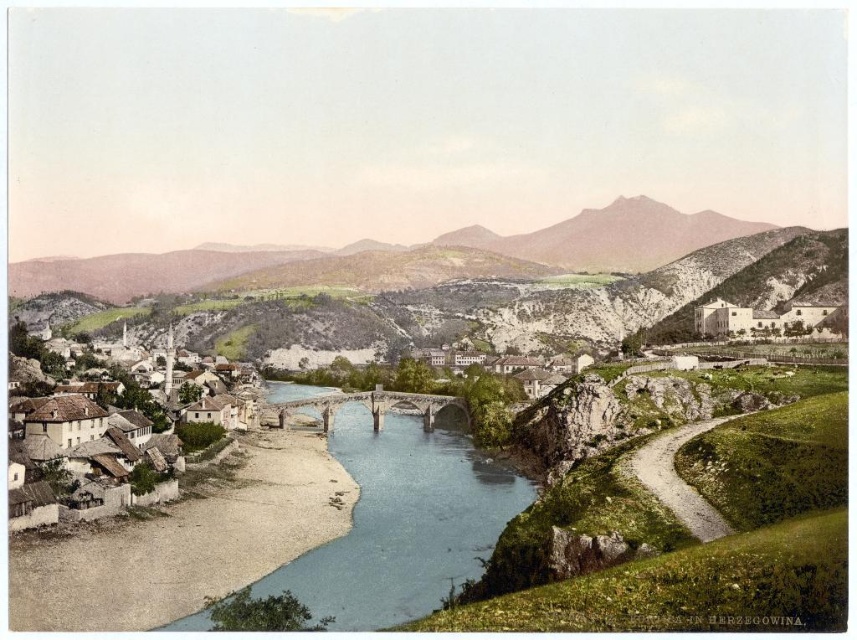
From the picture: Who is taller, blue stone river at center or white stone houses at lower left?

With more height is white stone houses at lower left.

Based on the photo, who is more forward, (357, 448) or (49, 406)?

Point (49, 406) is in front.

Where is `blue stone river at center`? The width and height of the screenshot is (857, 640). blue stone river at center is located at coordinates (402, 522).

Looking at this image, between rugged stone mountain at center and white stone houses at lower left, which one is positioned lower?

Positioned lower is white stone houses at lower left.

Can you confirm if rugged stone mountain at center is positioned above white stone houses at lower left?

Yes.

Locate an element on the screen. The width and height of the screenshot is (857, 640). rugged stone mountain at center is located at coordinates (454, 288).

Is rugged stone mountain at center positioned at the back of blue stone river at center?

Yes.

What do you see at coordinates (454, 288) in the screenshot?
I see `rugged stone mountain at center` at bounding box center [454, 288].

Is point (594, 220) closer to camera compared to point (342, 545)?

No.

This screenshot has height=640, width=857. What are the coordinates of `rugged stone mountain at center` in the screenshot? It's located at (454, 288).